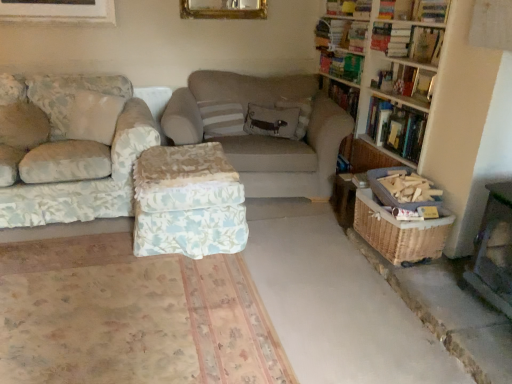
Question: In the image, is embroidered fabric pillow at center, the second pillow from the left, positioned in front of or behind floral fabric couch at left, the second studio couch when ordered from right to left?

Choices:
 (A) behind
 (B) front

Answer: (A)

Question: Is point (306, 97) positioned closer to the camera than point (88, 104)?

Choices:
 (A) closer
 (B) farther

Answer: (B)

Question: Estimate the real-world distances between objects in this image. Which object is closer to the woven brown basket at lower right?

Choices:
 (A) floral fabric couch at left, arranged as the 1th studio couch when viewed from the left
 (B) embroidered fabric pillow at center, the second pillow from the left
 (C) brown textured concrete at lower right, acting as the second concrete starting from the left
 (D) hardcover book at upper right, marked as the 5th book in a top-to-bottom arrangement
 (E) hardcover book at upper right, which is the second book from bottom to top

Answer: (C)

Question: Based on their relative distances, which object is nearer to the hardcover book at upper right, arranged as the 5th book when ordered from the bottom?

Choices:
 (A) brown textured concrete at lower right, acting as the second concrete starting from the left
 (B) wooden bookshelf at upper right
 (C) wooden bookshelf at right
 (D) floral fabric ottoman at center
 (E) hardcover book at upper center, which is the 3th book in bottom-to-top order

Answer: (B)